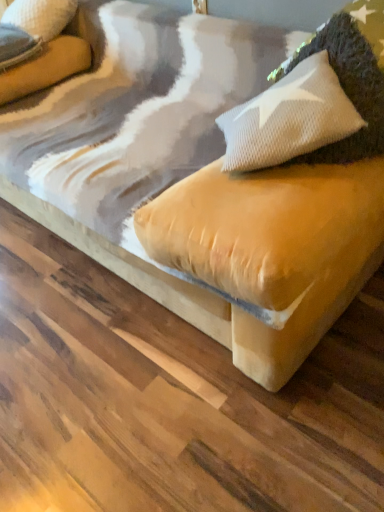
Question: Would you say velvet beige pillow at upper left, which is counted as the 1th pillow, starting from the top, is outside white textured pillow at upper right, the 2th pillow when ordered from top to bottom?

Choices:
 (A) yes
 (B) no

Answer: (A)

Question: From a real-world perspective, does velvet beige pillow at upper left, acting as the second pillow starting from the front, stand above white textured pillow at upper right, acting as the first pillow starting from the front?

Choices:
 (A) yes
 (B) no

Answer: (B)

Question: Can you confirm if velvet beige pillow at upper left, marked as the 1th pillow in a back-to-front arrangement, is taller than white textured pillow at upper right, the first pillow in the right-to-left sequence?

Choices:
 (A) no
 (B) yes

Answer: (A)

Question: Is velvet beige pillow at upper left, which is counted as the 1th pillow, starting from the top, with white textured pillow at upper right, which ranks as the second pillow in left-to-right order?

Choices:
 (A) yes
 (B) no

Answer: (B)

Question: Is velvet beige pillow at upper left, which is counted as the second pillow, starting from the right, to the right of white textured pillow at upper right, the 2th pillow when ordered from top to bottom, from the viewer's perspective?

Choices:
 (A) yes
 (B) no

Answer: (B)

Question: Is velvet beige pillow at upper left, positioned as the first pillow in left-to-right order, wider than white textured pillow at upper right, the 2th pillow when ordered from top to bottom?

Choices:
 (A) yes
 (B) no

Answer: (B)

Question: Is white textured pillow at upper right, the 2th pillow when ordered from top to bottom, positioned beyond the bounds of velvet beige pillow at upper left, which is counted as the second pillow, starting from the right?

Choices:
 (A) yes
 (B) no

Answer: (A)

Question: Considering the relative positions of white textured pillow at upper right, which is the second pillow from back to front, and velvet beige pillow at upper left, marked as the 1th pillow in a back-to-front arrangement, in the image provided, is white textured pillow at upper right, which is the second pillow from back to front, behind velvet beige pillow at upper left, marked as the 1th pillow in a back-to-front arrangement,?

Choices:
 (A) no
 (B) yes

Answer: (A)

Question: From a real-world perspective, is white textured pillow at upper right, placed as the 1th pillow when sorted from bottom to top, over velvet beige pillow at upper left, marked as the 1th pillow in a back-to-front arrangement?

Choices:
 (A) yes
 (B) no

Answer: (A)

Question: Considering the relative sizes of white textured pillow at upper right, which is the second pillow from back to front, and velvet beige pillow at upper left, which is counted as the 1th pillow, starting from the top, in the image provided, is white textured pillow at upper right, which is the second pillow from back to front, wider than velvet beige pillow at upper left, which is counted as the 1th pillow, starting from the top,?

Choices:
 (A) no
 (B) yes

Answer: (B)

Question: Would you say velvet beige pillow at upper left, which is counted as the second pillow, starting from the right, is part of white textured pillow at upper right, the 2th pillow when ordered from top to bottom,'s contents?

Choices:
 (A) no
 (B) yes

Answer: (A)

Question: Is white textured pillow at upper right, the first pillow in the right-to-left sequence, to the right of velvet beige pillow at upper left, which is counted as the 1th pillow, starting from the top, from the viewer's perspective?

Choices:
 (A) yes
 (B) no

Answer: (A)

Question: From their relative heights in the image, would you say velvet beige pillow at upper left, acting as the second pillow starting from the front, is taller or shorter than white textured pillow at upper right, the 2th pillow when ordered from top to bottom?

Choices:
 (A) short
 (B) tall

Answer: (A)